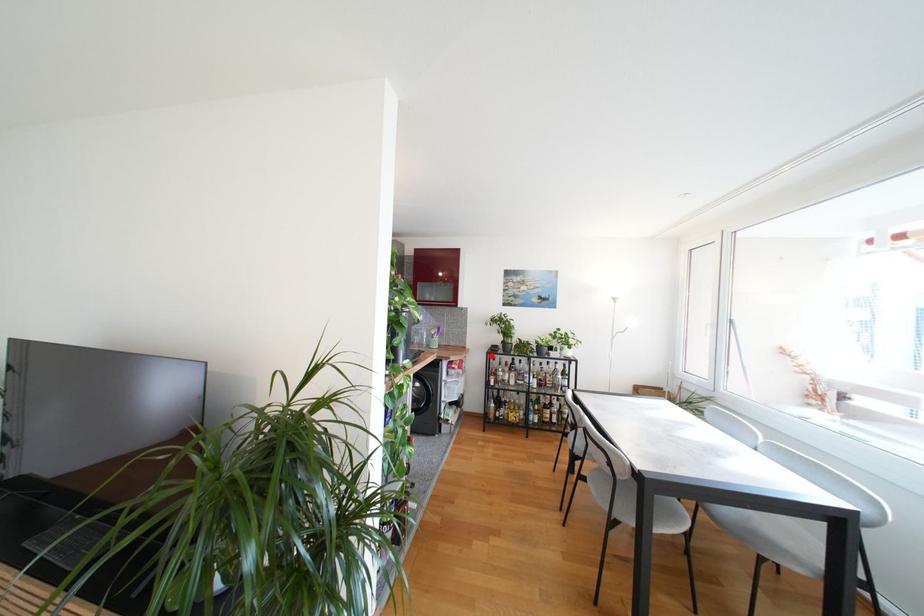
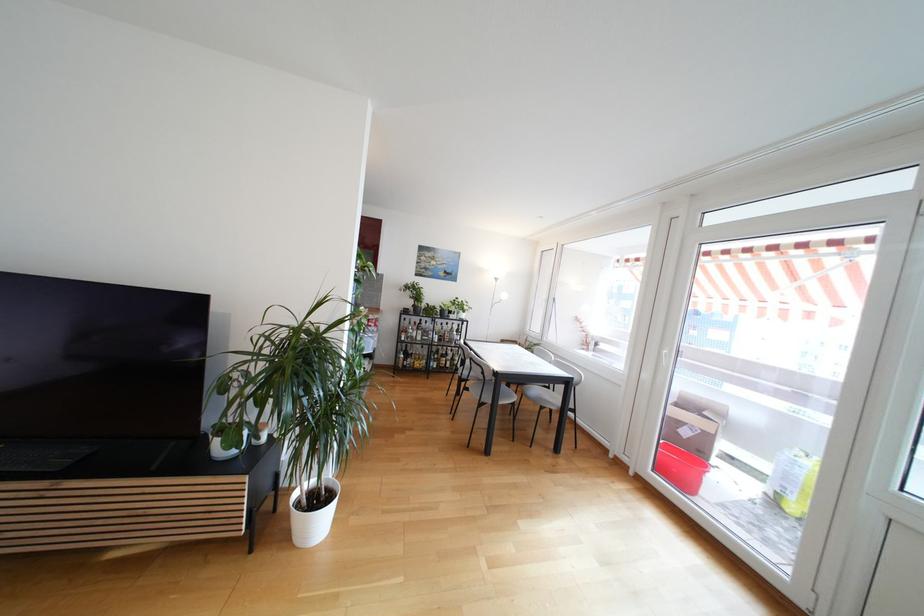
Locate, in the second image, the point that corresponds to the highlighted location in the first image.

(405, 315)